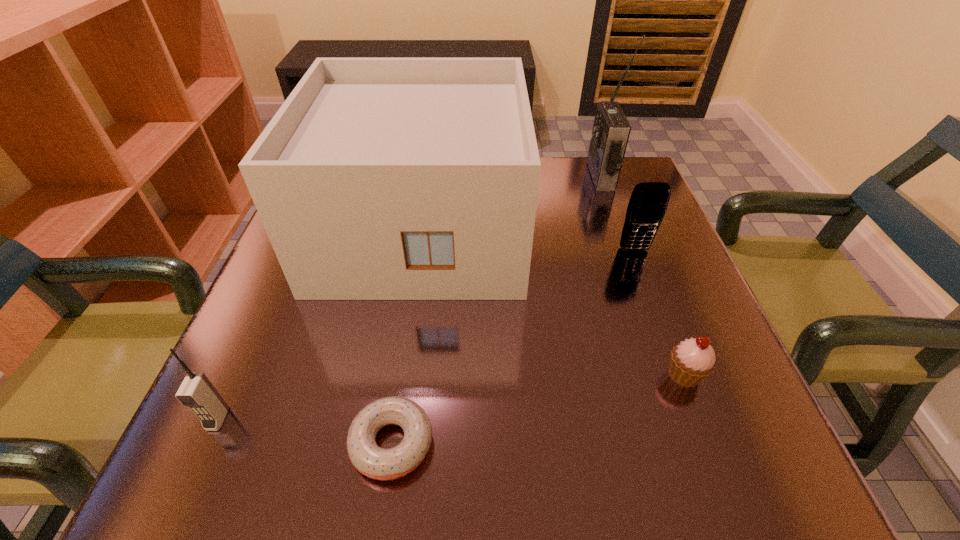
This screenshot has height=540, width=960. In order to click on radio receiver in this screenshot , I will do `click(611, 130)`.

Where is `the second tallest object`? This screenshot has height=540, width=960. the second tallest object is located at coordinates (378, 178).

The height and width of the screenshot is (540, 960). Identify the location of the farther cellular telephone. (648, 203).

You are a GUI agent. You are given a task and a screenshot of the screen. Output one action in this format:
    pyautogui.click(x=<x>, y=<y>)
    Task: Click on the leftmost object
    Image resolution: width=960 pixels, height=540 pixels.
    Given the screenshot: What is the action you would take?
    pyautogui.click(x=197, y=392)

The image size is (960, 540). Find the location of `the left cellular telephone`. the left cellular telephone is located at coordinates (197, 392).

What are the coordinates of `the third nearest object` in the screenshot? It's located at (692, 360).

Locate an element on the screen. This screenshot has height=540, width=960. cupcake is located at coordinates (692, 360).

Locate an element on the screen. Image resolution: width=960 pixels, height=540 pixels. doughnut is located at coordinates 366,456.

Image resolution: width=960 pixels, height=540 pixels. What are the coordinates of `free space located 0.260m on the display of the radio receiver` in the screenshot? It's located at (487, 176).

What are the coordinates of `free location located 0.330m on the display of the radio receiver` in the screenshot? It's located at (459, 176).